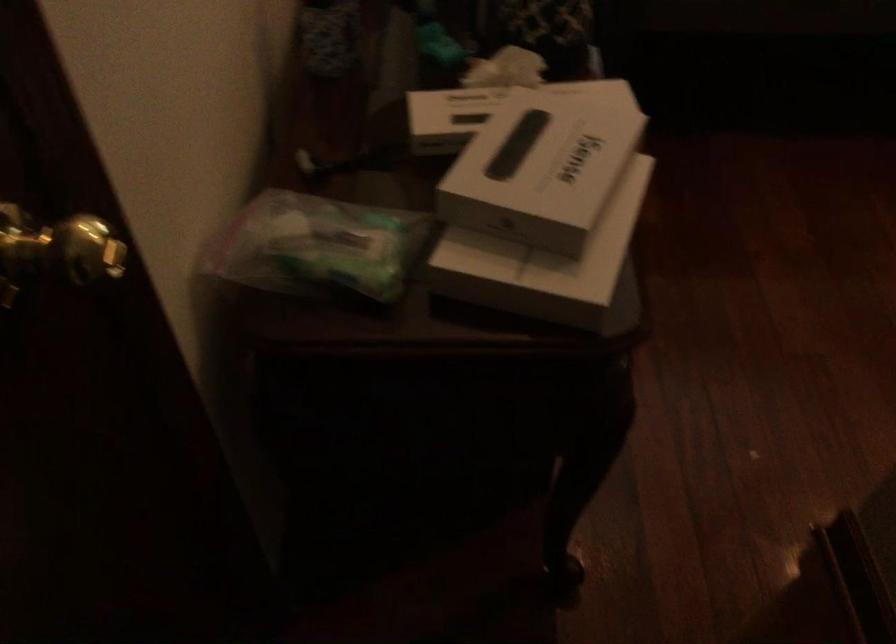
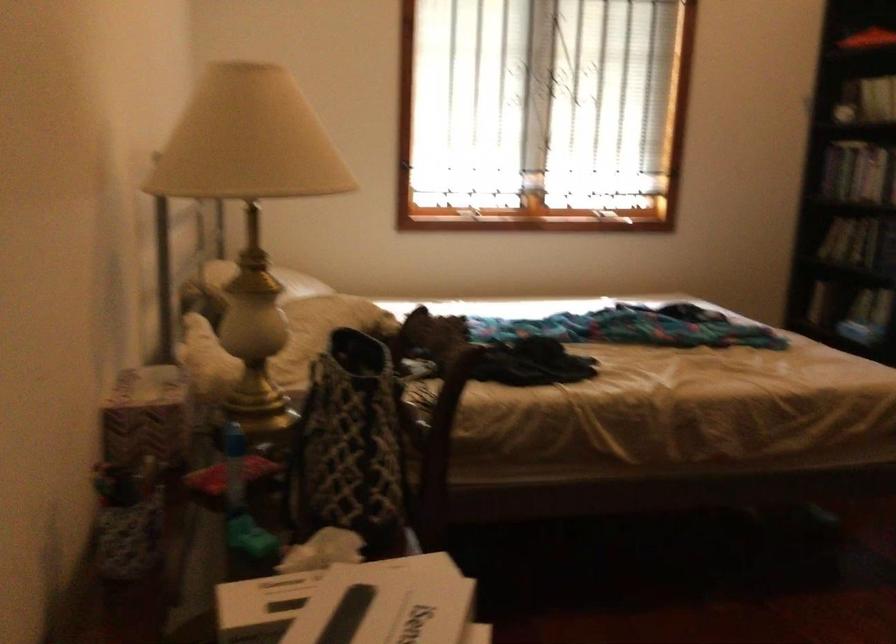
Based on the continuous images, in which direction is the camera rotating?

The rotation direction of the camera is right-up.